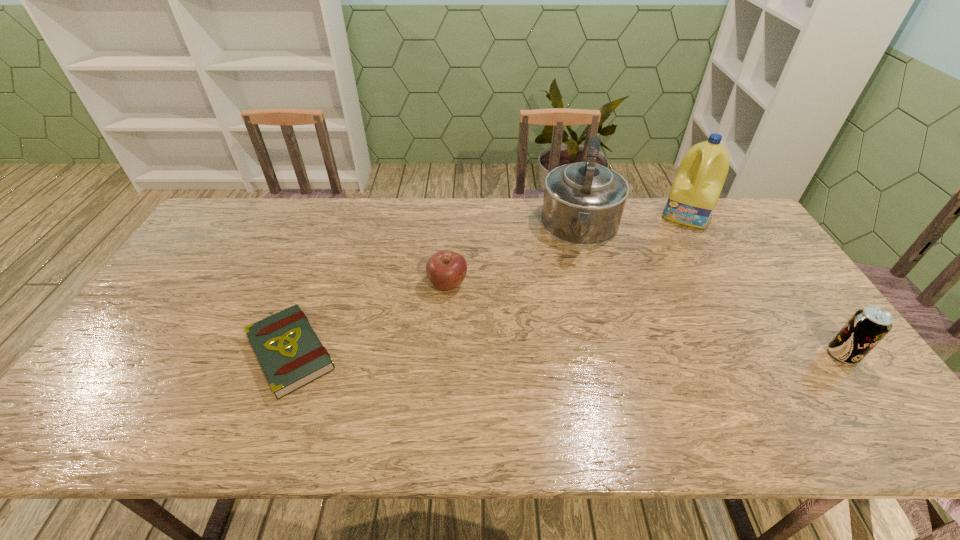
At what (x,y) coordinates should I click in order to perform the action: click on detergent situated at the far edge. Please return your answer as a coordinate pair (x, y). Looking at the image, I should click on (698, 183).

The image size is (960, 540). In order to click on object present at the near edge in this screenshot , I will do `click(291, 355)`.

Where is `soda can present at the right edge`? The image size is (960, 540). soda can present at the right edge is located at coordinates click(x=867, y=327).

Identify the location of detergent that is at the right edge. (698, 183).

What are the coordinates of `object present at the far right corner` in the screenshot? It's located at click(698, 183).

Find the location of a particular element. Image resolution: width=960 pixels, height=540 pixels. free space at the far edge is located at coordinates (649, 198).

The width and height of the screenshot is (960, 540). Identify the location of free space at the left edge. (175, 348).

At what (x,y) coordinates should I click in order to perform the action: click on blank space at the far left corner of the desktop. Please return your answer as a coordinate pair (x, y). The image size is (960, 540). Looking at the image, I should click on (233, 235).

The width and height of the screenshot is (960, 540). In the image, there is a desktop. Identify the location of vacant space at the far right corner. (725, 219).

Where is `free spot between the rightmost object and the third farthest object`? free spot between the rightmost object and the third farthest object is located at coordinates (645, 319).